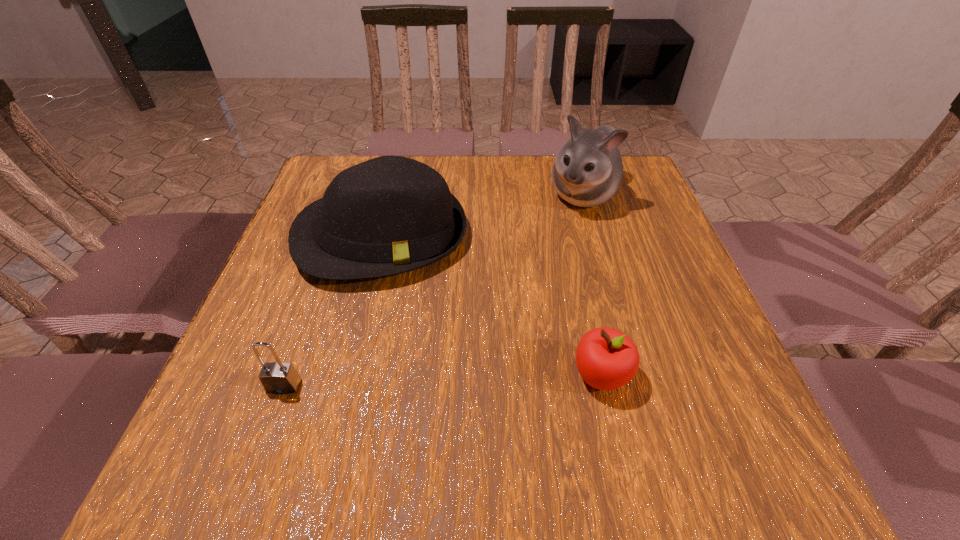
Where is `free space located 0.140m on the front-facing side of the fedora`? free space located 0.140m on the front-facing side of the fedora is located at coordinates (410, 340).

I want to click on hamster that is at the far edge, so click(x=588, y=170).

Where is `fedora located in the far edge section of the desktop`? The height and width of the screenshot is (540, 960). fedora located in the far edge section of the desktop is located at coordinates (389, 215).

You are a GUI agent. You are given a task and a screenshot of the screen. Output one action in this format:
    pyautogui.click(x=<x>, y=<y>)
    Task: Click on the padlock present at the near edge
    The image size is (960, 540).
    Given the screenshot: What is the action you would take?
    pyautogui.click(x=278, y=377)

You are a GUI agent. You are given a task and a screenshot of the screen. Output one action in this format:
    pyautogui.click(x=<x>, y=<y>)
    Task: Click on the apple that is at the near edge
    The width and height of the screenshot is (960, 540).
    Given the screenshot: What is the action you would take?
    pyautogui.click(x=606, y=358)

Identify the location of padlock that is at the left edge. The height and width of the screenshot is (540, 960). point(278,377).

At what (x,y) coordinates should I click in order to perform the action: click on fedora at the left edge. Please return your answer as a coordinate pair (x, y). Looking at the image, I should click on (389, 215).

The image size is (960, 540). Find the location of `object at the right edge`. object at the right edge is located at coordinates (588, 170).

Image resolution: width=960 pixels, height=540 pixels. Find the location of `object present at the far left corner`. object present at the far left corner is located at coordinates (389, 215).

Where is `object that is at the near left corner`? Image resolution: width=960 pixels, height=540 pixels. object that is at the near left corner is located at coordinates (278, 377).